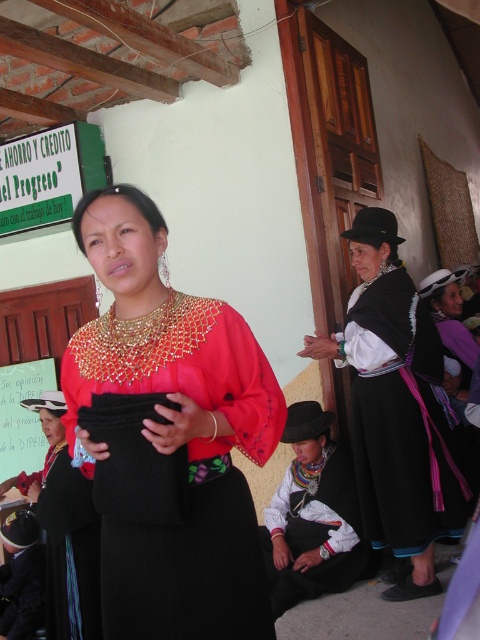
You are organizing a fashion show and need to arrange the black satin dress at center and the white woven fabric at lower center on a runway. Which one requires a wider runway to display properly?

The black satin dress at center requires a wider runway because its width is larger than the white woven fabric at lower center.